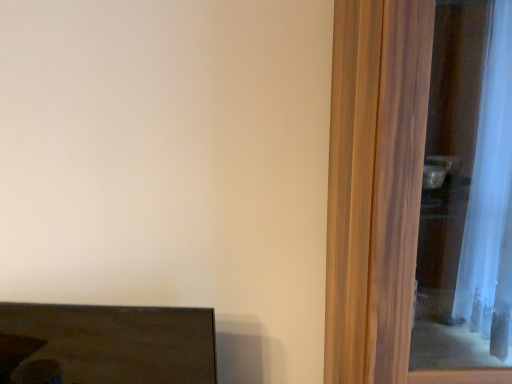
Describe the element at coordinates (106, 344) in the screenshot. I see `matte dark brown coffee table at lower left` at that location.

Locate an element on the screen. Image resolution: width=512 pixels, height=384 pixels. matte dark brown coffee table at lower left is located at coordinates (106, 344).

In order to face transparent glass screen door at right, should I rotate leftwards or rightwards?

Turn right approximately 27.629 degrees to face it.

What is the approximate width of transparent glass screen door at right?

transparent glass screen door at right is 20.32 inches wide.

This screenshot has height=384, width=512. What do you see at coordinates (378, 192) in the screenshot? I see `transparent glass screen door at right` at bounding box center [378, 192].

Find the location of a particular element. Image resolution: width=512 pixels, height=384 pixels. transparent glass screen door at right is located at coordinates (378, 192).

What are the coordinates of `matte dark brown coffee table at lower left` in the screenshot? It's located at (106, 344).

Is transparent glass screen door at right to the right of matte dark brown coffee table at lower left from the viewer's perspective?

Correct, you'll find transparent glass screen door at right to the right of matte dark brown coffee table at lower left.

Does transparent glass screen door at right come behind matte dark brown coffee table at lower left?

No, transparent glass screen door at right is closer to the viewer.

Between point (340, 210) and point (161, 366), which one is positioned behind?

The point (161, 366) is behind.

From the image's perspective, is transparent glass screen door at right on top of matte dark brown coffee table at lower left?

Yes, from the image's perspective, transparent glass screen door at right is on top of matte dark brown coffee table at lower left.

From a real-world perspective, is transparent glass screen door at right over matte dark brown coffee table at lower left?

Yes, from a real-world perspective, transparent glass screen door at right is above matte dark brown coffee table at lower left.

Looking at this image, which of these two, transparent glass screen door at right or matte dark brown coffee table at lower left, is wider?

Wider between the two is transparent glass screen door at right.

Considering the sizes of objects transparent glass screen door at right and matte dark brown coffee table at lower left in the image provided, who is taller, transparent glass screen door at right or matte dark brown coffee table at lower left?

transparent glass screen door at right is taller.

Can you confirm if transparent glass screen door at right is smaller than matte dark brown coffee table at lower left?

Incorrect, transparent glass screen door at right is not smaller in size than matte dark brown coffee table at lower left.

Could matte dark brown coffee table at lower left be considered to be inside transparent glass screen door at right?

No, matte dark brown coffee table at lower left is not inside transparent glass screen door at right.

Is transparent glass screen door at right far away from matte dark brown coffee table at lower left?

No, transparent glass screen door at right is not far away from matte dark brown coffee table at lower left.

Could you tell me if transparent glass screen door at right is facing matte dark brown coffee table at lower left?

No, transparent glass screen door at right is not facing towards matte dark brown coffee table at lower left.

How different are the orientations of transparent glass screen door at right and matte dark brown coffee table at lower left in degrees?

They differ by 10.5 degrees in their facing directions.

How far apart are transparent glass screen door at right and matte dark brown coffee table at lower left?

transparent glass screen door at right and matte dark brown coffee table at lower left are 25.36 inches apart.

Find the location of `furniture located below the transparent glass screen door at right (from the image's perspective)`. furniture located below the transparent glass screen door at right (from the image's perspective) is located at coordinates 106,344.

Can you confirm if matte dark brown coffee table at lower left is positioned to the left of transparent glass screen door at right?

Yes.

Considering the positions of objects matte dark brown coffee table at lower left and transparent glass screen door at right in the image provided, who is in front, matte dark brown coffee table at lower left or transparent glass screen door at right?

transparent glass screen door at right is more forward.

Is point (120, 308) farther from camera compared to point (364, 2)?

Yes, point (120, 308) is behind point (364, 2).

From the image's perspective, would you say matte dark brown coffee table at lower left is shown under transparent glass screen door at right?

Yes, from the image's perspective, matte dark brown coffee table at lower left is below transparent glass screen door at right.

From a real-world perspective, which object stands above the other?

From a 3D spatial view, transparent glass screen door at right is above.

Which object is wider, matte dark brown coffee table at lower left or transparent glass screen door at right?

transparent glass screen door at right is wider.

Between matte dark brown coffee table at lower left and transparent glass screen door at right, which one has more height?

transparent glass screen door at right is taller.

Does matte dark brown coffee table at lower left have a smaller size compared to transparent glass screen door at right?

Yes, matte dark brown coffee table at lower left is smaller than transparent glass screen door at right.

Is transparent glass screen door at right located within matte dark brown coffee table at lower left?

No, transparent glass screen door at right is not surrounded by matte dark brown coffee table at lower left.

Does matte dark brown coffee table at lower left touch transparent glass screen door at right?

No, matte dark brown coffee table at lower left is not making contact with transparent glass screen door at right.

Is matte dark brown coffee table at lower left positioned with its back to transparent glass screen door at right?

matte dark brown coffee table at lower left is not turned away from transparent glass screen door at right.

Consider the image. Could you measure the distance between matte dark brown coffee table at lower left and transparent glass screen door at right?

A distance of 25.36 inches exists between matte dark brown coffee table at lower left and transparent glass screen door at right.

Locate an element on the screen. The height and width of the screenshot is (384, 512). furniture below the transparent glass screen door at right (from the image's perspective) is located at coordinates click(x=106, y=344).

This screenshot has width=512, height=384. Find the location of `furniture that appears on the left of transparent glass screen door at right`. furniture that appears on the left of transparent glass screen door at right is located at coordinates (106, 344).

Identify the location of furniture below the transparent glass screen door at right (from the image's perspective). The width and height of the screenshot is (512, 384). (106, 344).